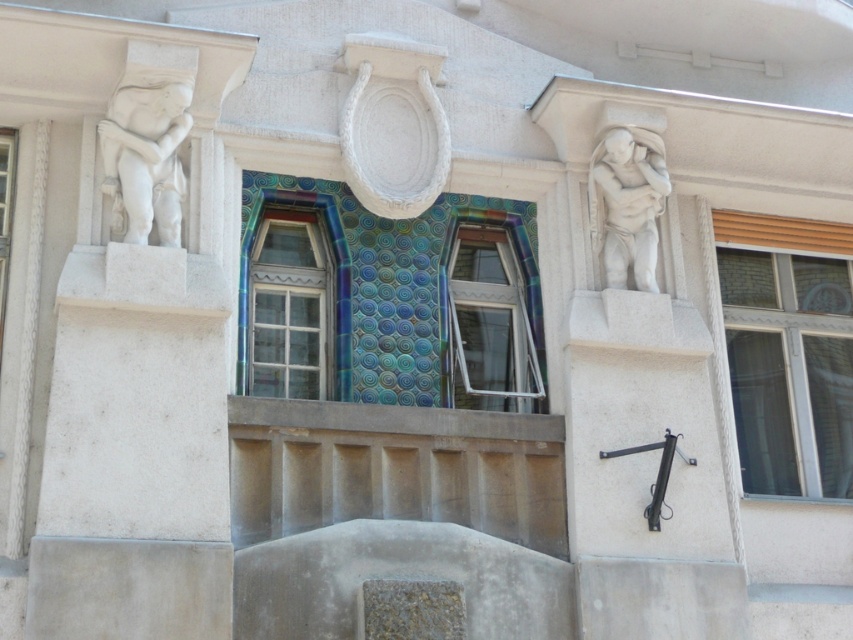
Is white plastic window at center smaller than multicolored mosaic tile at center?

No, white plastic window at center is not smaller than multicolored mosaic tile at center.

Who is positioned more to the left, white plastic window at center or multicolored mosaic tile at center?

multicolored mosaic tile at center

Who is more distant from viewer, (460, 328) or (347, 384)?

Point (460, 328)

I want to click on white plastic window at center, so click(491, 323).

Based on the photo, measure the distance from white marble statue at upper left to white stone sculpture at right.

3.94 meters

Which is behind, point (149, 205) or point (648, 230)?

The point (648, 230) is behind.

Identify the location of white marble statue at upper left. (144, 157).

Can you confirm if clear glass window at right is thinner than white plastic window at center?

Incorrect, clear glass window at right's width is not less than white plastic window at center's.

The width and height of the screenshot is (853, 640). What do you see at coordinates (788, 369) in the screenshot?
I see `clear glass window at right` at bounding box center [788, 369].

The height and width of the screenshot is (640, 853). I want to click on clear glass window at right, so click(x=788, y=369).